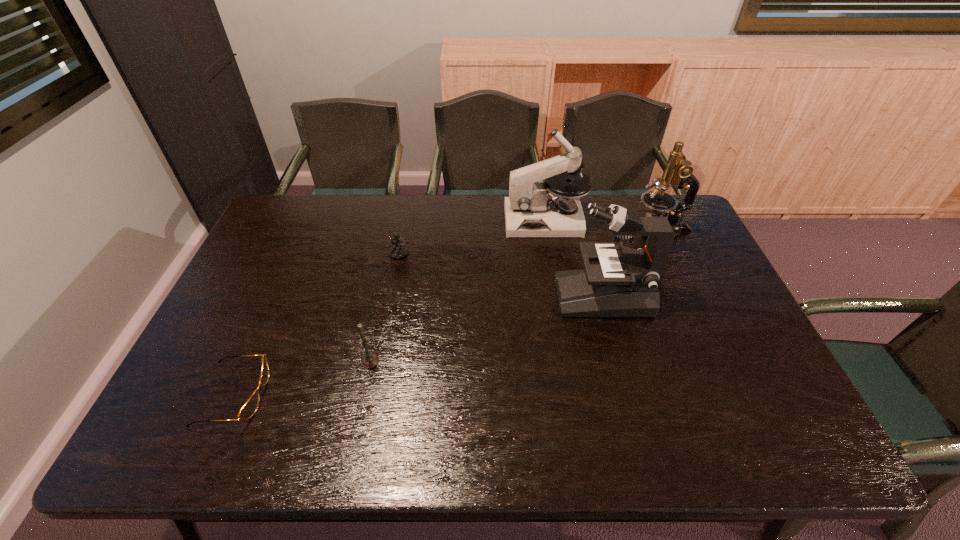
Find the location of a particular element. The width and height of the screenshot is (960, 540). the nearest microscope is located at coordinates click(x=625, y=284).

Image resolution: width=960 pixels, height=540 pixels. What are the coordinates of `the rightmost object` in the screenshot? It's located at (678, 172).

You are a GUI agent. You are given a task and a screenshot of the screen. Output one action in this format:
    pyautogui.click(x=<x>, y=<y>)
    Task: Click on the third shortest object
    
    Given the screenshot: What is the action you would take?
    pyautogui.click(x=370, y=360)

You are a GUI agent. You are given a task and a screenshot of the screen. Output one action in this format:
    pyautogui.click(x=<x>, y=<y>)
    Task: Click on the third farthest object
    Image resolution: width=960 pixels, height=540 pixels.
    Given the screenshot: What is the action you would take?
    pyautogui.click(x=396, y=248)

Where is `pinecone`? The width and height of the screenshot is (960, 540). pinecone is located at coordinates (396, 248).

What are the coordinates of `spectacles` in the screenshot? It's located at (249, 408).

You are a GUI agent. You are given a task and a screenshot of the screen. Output one action in this format:
    pyautogui.click(x=<x>, y=<y>)
    Task: Click on the shortest object
    
    Given the screenshot: What is the action you would take?
    pyautogui.click(x=249, y=408)

I want to click on vacant region located through the eyepieces of the nearest microscope, so click(x=537, y=295).

I want to click on vacant area situated through the eyepieces of the nearest microscope, so click(x=423, y=295).

Locate an element on the screen. This screenshot has height=540, width=960. vacant space located through the eyepieces of the nearest microscope is located at coordinates pyautogui.click(x=519, y=295).